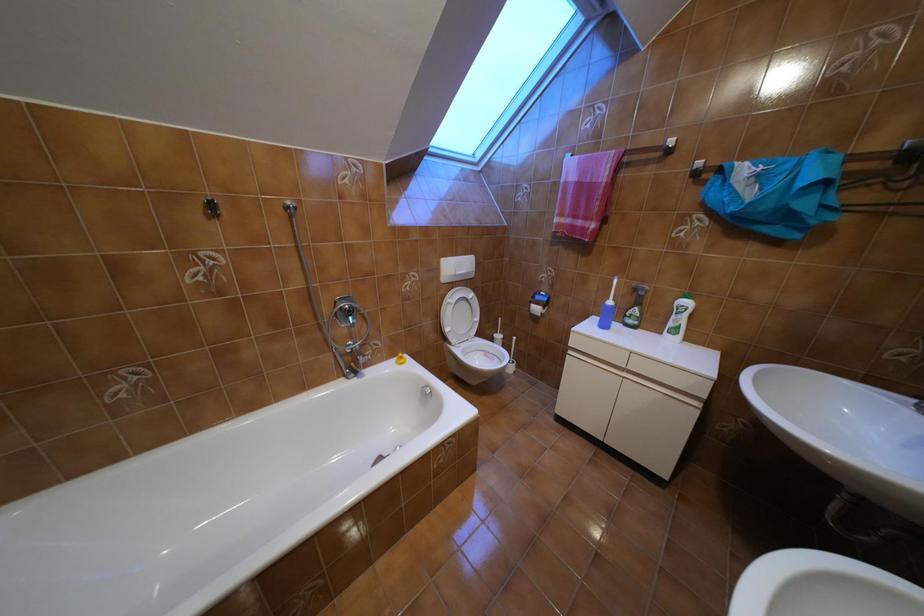
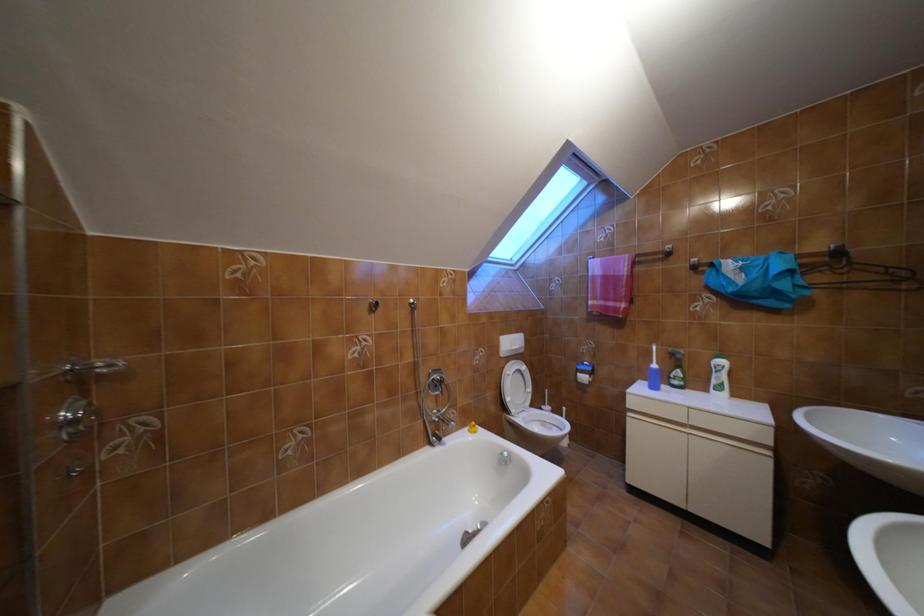
Question: Based on the continuous images, in which direction is the camera rotating? Reply with the corresponding letter.

Choices:
 (A) Left
 (B) Right
 (C) Up
 (D) Down

Answer: (C)